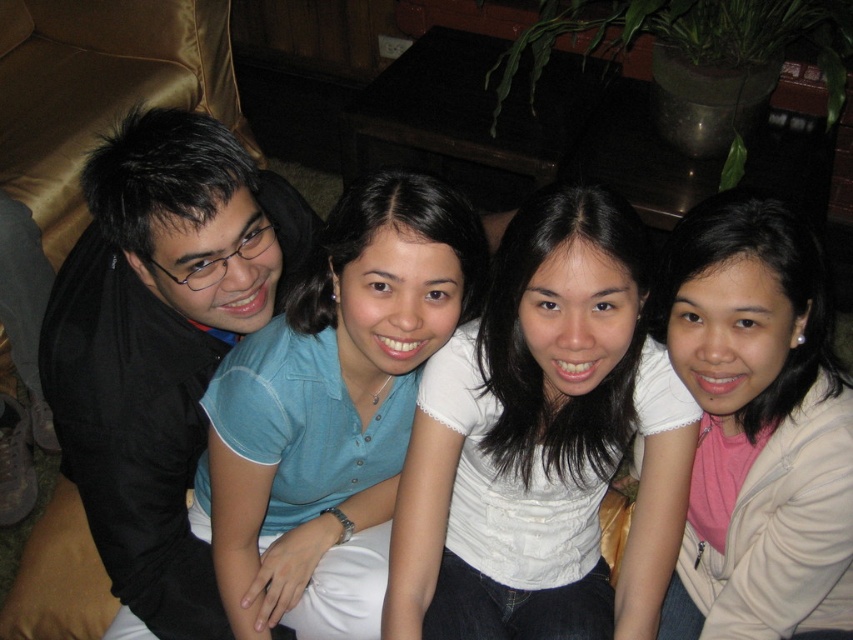
Who is positioned more to the right, white textured shirt at center or black matte jacket at left?

white textured shirt at center is more to the right.

Can you confirm if white textured shirt at center is wider than black matte jacket at left?

No, white textured shirt at center is not wider than black matte jacket at left.

Where is `white textured shirt at center`? This screenshot has height=640, width=853. white textured shirt at center is located at coordinates (543, 442).

The height and width of the screenshot is (640, 853). What do you see at coordinates (160, 342) in the screenshot? I see `black matte jacket at left` at bounding box center [160, 342].

Does black matte jacket at left appear on the right side of beige fleece jacket at lower right?

Incorrect, black matte jacket at left is not on the right side of beige fleece jacket at lower right.

Is point (192, 164) farther from camera compared to point (683, 260)?

Yes.

I want to click on black matte jacket at left, so click(160, 342).

Is point (335, 484) positioned after point (791, 499)?

That is True.

Is blue cotton shirt at center below beige fleece jacket at lower right?

No.

Who is more forward, (405, 397) or (764, 573)?

Point (764, 573)

Where is `blue cotton shirt at center`? blue cotton shirt at center is located at coordinates (334, 388).